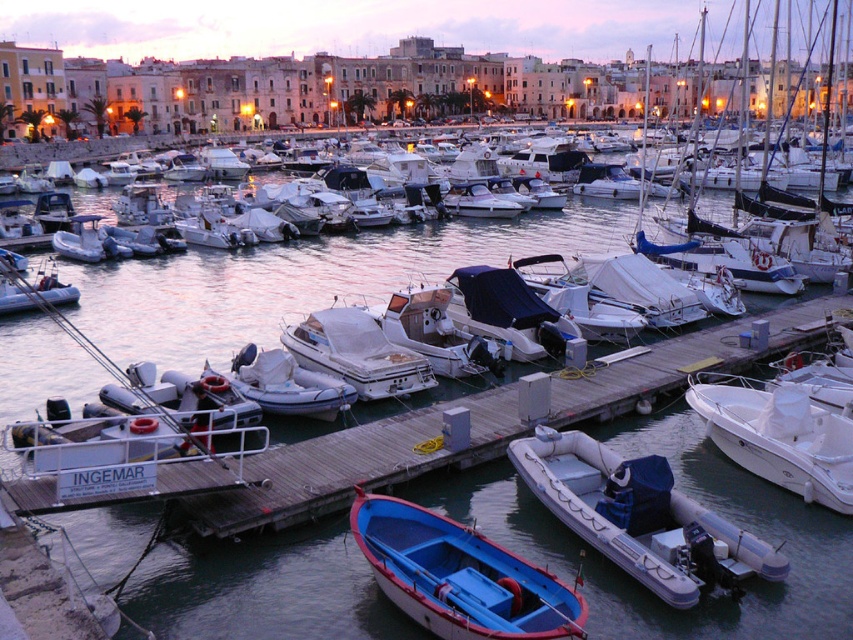
Which is behind, point (393, 600) or point (302, 339)?

Point (302, 339)

Which is in front, point (509, 621) or point (331, 333)?

Positioned in front is point (509, 621).

Is point (456, 588) in front of point (372, 352)?

That is True.

Image resolution: width=853 pixels, height=640 pixels. What are the coordinates of `blue matte rowboat at center` in the screenshot? It's located at (459, 576).

Can you confirm if wooden dock at center is positioned to the left of blue matte rowboat at center?

No, wooden dock at center is not to the left of blue matte rowboat at center.

Can you confirm if wooden dock at center is positioned above blue matte rowboat at center?

Yes.

What do you see at coordinates (351, 465) in the screenshot? Image resolution: width=853 pixels, height=640 pixels. I see `wooden dock at center` at bounding box center [351, 465].

Identify the location of wooden dock at center. (351, 465).

Between rubber dinghy at lower right and white matte motorboat at center, which one has less height?

Standing shorter between the two is white matte motorboat at center.

Does point (596, 520) come in front of point (90, 260)?

Yes, point (596, 520) is in front of point (90, 260).

In order to click on rubber dinghy at lower right in this screenshot , I will do `click(639, 516)`.